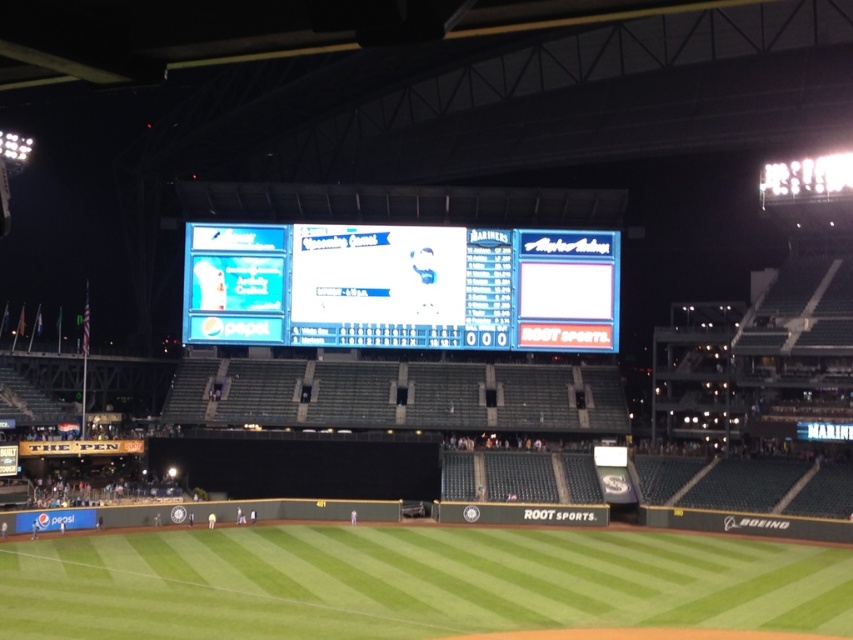
You are a photographer trying to capture a clear photo of the blue glossy scoreboard at center without any obstructions. Based on the scene description, will the green grass at center block the view of the scoreboard in your photo?

The green grass at center is in front of the blue glossy scoreboard at center, so it will block the view of the scoreboard in the photo.

You are a drone operator trying to capture a shot of the green grass at center and the blue glossy scoreboard at center from above. The drone has a maximum camera range of 120 feet. Will the drone be able to capture both objects in a single shot without moving the drone?

The green grass at center and blue glossy scoreboard at center are 120.13 feet apart. Since the distance between them exceeds the drone camera range of 120 feet, the drone cannot capture both objects in a single shot without moving.

You are standing at the edge of the baseball field and see a point marked at coordinates (410, 580). Based on the scene description, what is the most likely object located at that point?

The point at coordinates (410, 580) corresponds to green grass at center.